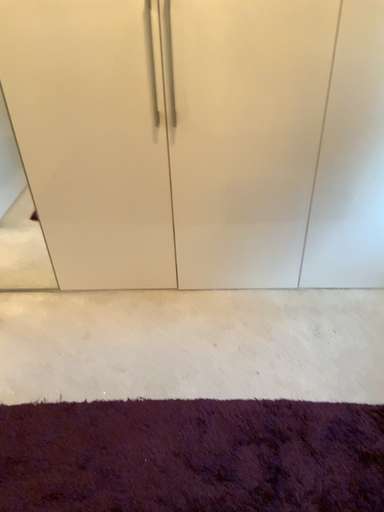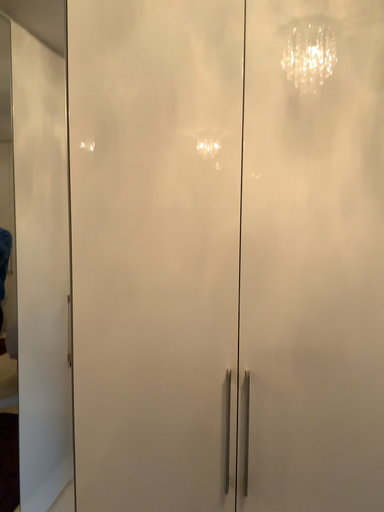
Question: How did the camera likely rotate when shooting the video?

Choices:
 (A) rotated upward
 (B) rotated downward

Answer: (A)